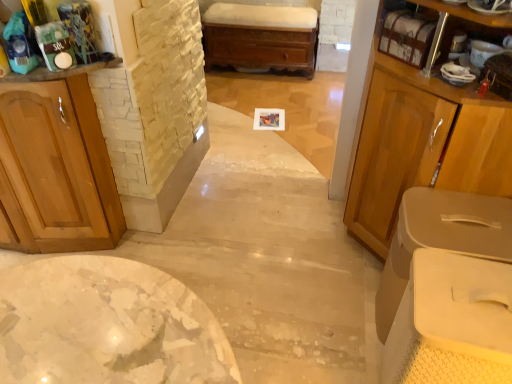
Question: Considering the relative positions of wooden chest at center and wooden cabinet at left, which is the first cabinetry from left to right, in the image provided, is wooden chest at center to the left or to the right of wooden cabinet at left, which is the first cabinetry from left to right,?

Choices:
 (A) left
 (B) right

Answer: (B)

Question: Is wooden chest at center situated inside wooden cabinet at left, which is the first cabinetry from left to right, or outside?

Choices:
 (A) inside
 (B) outside

Answer: (B)

Question: Which object is the farthest from the beige plastic bins at right, the 3th cabinetry positioned from the left?

Choices:
 (A) matte wood cabinet at right, the 2th cabinetry positioned from the right
 (B) wooden cabinet at left, arranged as the third cabinetry when viewed from the right
 (C) wooden shelf at upper right
 (D) wooden chest at center

Answer: (D)

Question: Which is nearer to the wooden chest at center?

Choices:
 (A) matte wood cabinet at right, positioned as the 2th cabinetry in left-to-right order
 (B) beige plastic bins at right, which is counted as the 1th cabinetry, starting from the right
 (C) wooden cabinet at left, which is the first cabinetry from left to right
 (D) wooden shelf at upper right

Answer: (D)